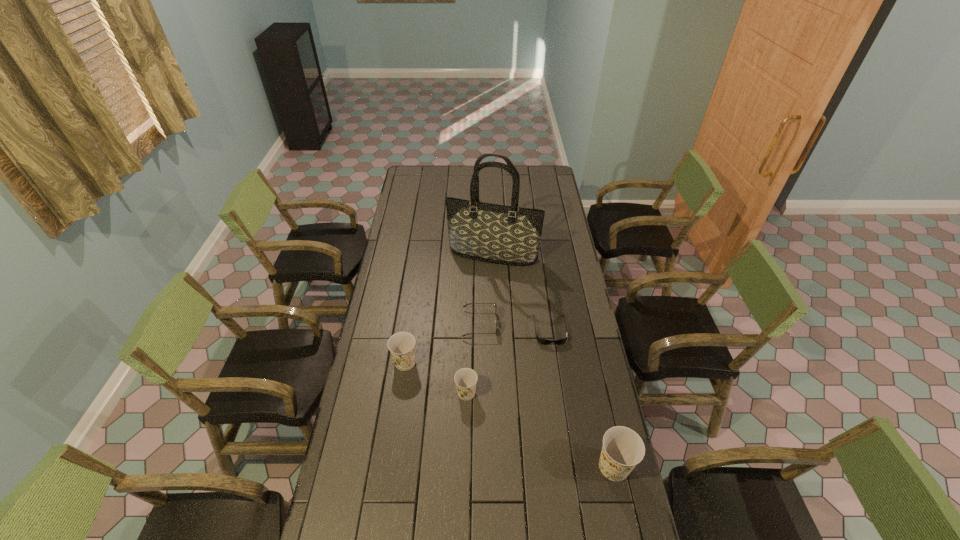
Find the location of a particular element. Image resolution: width=960 pixels, height=540 pixels. unoccupied area between the tallest object and the left sunglasses is located at coordinates (487, 289).

Find the location of a particular element. unoccupied area between the leftmost object and the shortest Dixie cup is located at coordinates (436, 378).

This screenshot has width=960, height=540. In order to click on vacant area that lies between the shortest object and the fifth tallest object in this screenshot , I will do `click(515, 327)`.

At what (x,y) coordinates should I click in order to perform the action: click on free spot between the shortest object and the second tallest object. Please return your answer as a coordinate pair (x, y). Looking at the image, I should click on (582, 399).

At what (x,y) coordinates should I click in order to perform the action: click on free spot between the shorter sunglasses and the taller sunglasses. Please return your answer as a coordinate pair (x, y). The image size is (960, 540). Looking at the image, I should click on (515, 327).

This screenshot has width=960, height=540. In order to click on vacant area between the farthest object and the left sunglasses in this screenshot , I will do `click(487, 289)`.

Where is `free spot between the fifth farthest object and the rightmost object`? The width and height of the screenshot is (960, 540). free spot between the fifth farthest object and the rightmost object is located at coordinates (540, 430).

This screenshot has height=540, width=960. In order to click on free point between the shorter sunglasses and the fifth tallest object in this screenshot , I will do `click(515, 327)`.

Identify which object is the fourth nearest to the shorter sunglasses. Please provide its 2D coordinates. Your answer should be formatted as a tuple, i.e. [(x, y)], where the tuple contains the x and y coordinates of a point satisfying the conditions above.

[(623, 448)]

Identify which object is the fourth closest to the rightmost Dixie cup. Please provide its 2D coordinates. Your answer should be formatted as a tuple, i.e. [(x, y)], where the tuple contains the x and y coordinates of a point satisfying the conditions above.

[(402, 344)]